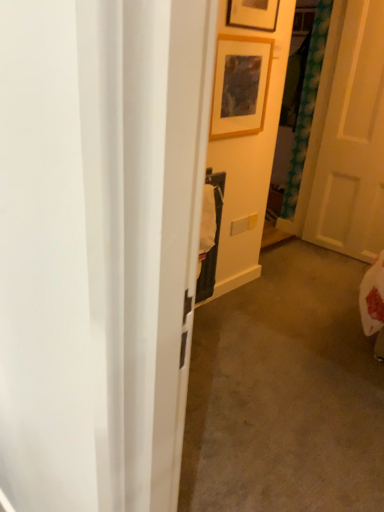
Question: Does white matte door at right have a lesser width compared to wooden picture frame at upper center, the 1th picture frame when ordered from top to bottom?

Choices:
 (A) yes
 (B) no

Answer: (B)

Question: Is white matte door at right positioned beyond the bounds of wooden picture frame at upper center, the 1th picture frame when ordered from top to bottom?

Choices:
 (A) no
 (B) yes

Answer: (B)

Question: Does white matte door at right have a greater height compared to wooden picture frame at upper center, the 2th picture frame positioned from the bottom?

Choices:
 (A) yes
 (B) no

Answer: (A)

Question: From a real-world perspective, is white matte door at right on wooden picture frame at upper center, the 2th picture frame positioned from the bottom?

Choices:
 (A) yes
 (B) no

Answer: (B)

Question: Does white matte door at right come behind wooden picture frame at upper center, the 2th picture frame positioned from the bottom?

Choices:
 (A) no
 (B) yes

Answer: (B)

Question: From the image's perspective, relative to wooden picture frame at upper center, the 2th picture frame positioned from the bottom, is wooden frame at upper center, placed as the first picture frame when sorted from bottom to top, above or below?

Choices:
 (A) below
 (B) above

Answer: (A)

Question: From a real-world perspective, is wooden frame at upper center, the 2th picture frame from the top, positioned above or below wooden picture frame at upper center, the 1th picture frame when ordered from top to bottom?

Choices:
 (A) above
 (B) below

Answer: (B)

Question: Considering their positions, is wooden frame at upper center, the 2th picture frame from the top, located in front of or behind wooden picture frame at upper center, the 2th picture frame positioned from the bottom?

Choices:
 (A) front
 (B) behind

Answer: (B)

Question: In terms of size, does wooden frame at upper center, placed as the first picture frame when sorted from bottom to top, appear bigger or smaller than wooden picture frame at upper center, the 2th picture frame positioned from the bottom?

Choices:
 (A) small
 (B) big

Answer: (B)

Question: Is wooden picture frame at upper center, the 1th picture frame when ordered from top to bottom, wider or thinner than wooden frame at upper center, the 2th picture frame from the top?

Choices:
 (A) wide
 (B) thin

Answer: (B)

Question: Considering their positions, is wooden picture frame at upper center, the 1th picture frame when ordered from top to bottom, located in front of or behind wooden frame at upper center, the 2th picture frame from the top?

Choices:
 (A) front
 (B) behind

Answer: (A)

Question: Is point (271, 11) closer or farther from the camera than point (235, 119)?

Choices:
 (A) farther
 (B) closer

Answer: (B)

Question: From their relative heights in the image, would you say wooden picture frame at upper center, the 1th picture frame when ordered from top to bottom, is taller or shorter than wooden frame at upper center, placed as the first picture frame when sorted from bottom to top?

Choices:
 (A) short
 (B) tall

Answer: (B)

Question: From the image's perspective, is wooden picture frame at upper center, the 2th picture frame positioned from the bottom, located above or below white matte door at right?

Choices:
 (A) above
 (B) below

Answer: (A)

Question: Would you say wooden picture frame at upper center, the 2th picture frame positioned from the bottom, is to the left or to the right of white matte door at right in the picture?

Choices:
 (A) left
 (B) right

Answer: (A)